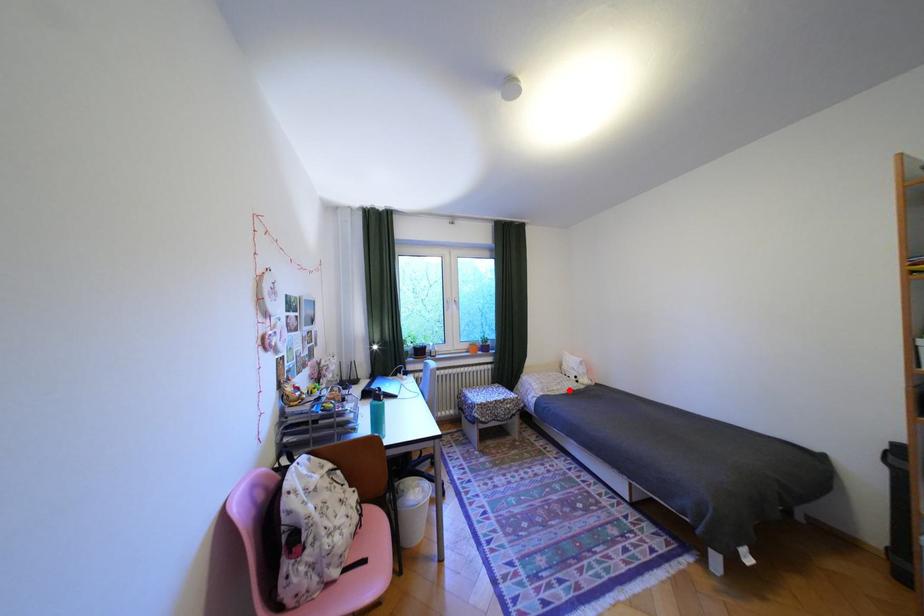
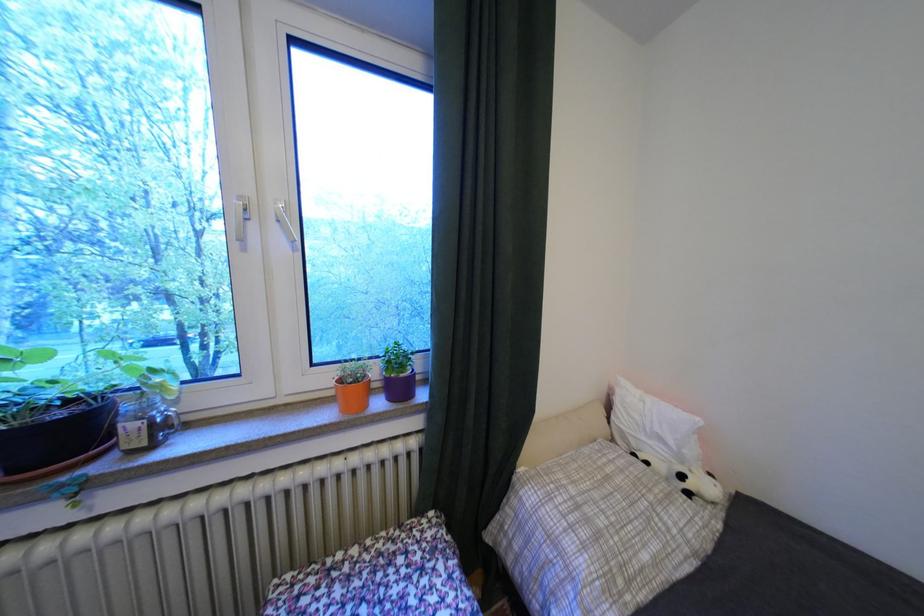
Question: I am providing you with two images of the same scene from different viewpoints. A red point is marked on the first image. Can you still see the location of the red point in image 2?

Choices:
 (A) Yes
 (B) No

Answer: (A)